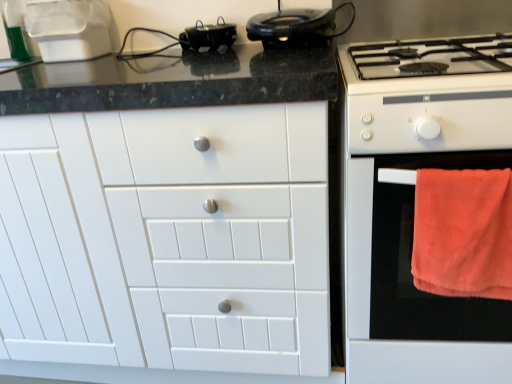
Question: Can we say white glossy gas stove at right lies outside orange towel at right?

Choices:
 (A) yes
 (B) no

Answer: (A)

Question: Can you confirm if white glossy gas stove at right is wider than orange towel at right?

Choices:
 (A) no
 (B) yes

Answer: (B)

Question: Is white glossy gas stove at right positioned far away from orange towel at right?

Choices:
 (A) no
 (B) yes

Answer: (A)

Question: Considering the relative positions of white glossy gas stove at right and orange towel at right in the image provided, is white glossy gas stove at right behind orange towel at right?

Choices:
 (A) yes
 (B) no

Answer: (B)

Question: Can you confirm if white glossy gas stove at right is smaller than orange towel at right?

Choices:
 (A) yes
 (B) no

Answer: (A)

Question: Is white glossy gas stove at right oriented towards orange towel at right?

Choices:
 (A) no
 (B) yes

Answer: (A)

Question: Is orange towel at right shorter than orange soft towel at right?

Choices:
 (A) yes
 (B) no

Answer: (B)

Question: Could you tell me if orange towel at right is facing orange soft towel at right?

Choices:
 (A) no
 (B) yes

Answer: (B)

Question: Is orange towel at right in contact with orange soft towel at right?

Choices:
 (A) no
 (B) yes

Answer: (A)

Question: Does orange towel at right have a lesser width compared to orange soft towel at right?

Choices:
 (A) yes
 (B) no

Answer: (B)

Question: Is orange towel at right at the left side of orange soft towel at right?

Choices:
 (A) no
 (B) yes

Answer: (A)

Question: Is orange towel at right not inside orange soft towel at right?

Choices:
 (A) no
 (B) yes

Answer: (B)

Question: From the image's perspective, is orange soft towel at right above shiny black steering wheel at upper center?

Choices:
 (A) yes
 (B) no

Answer: (B)